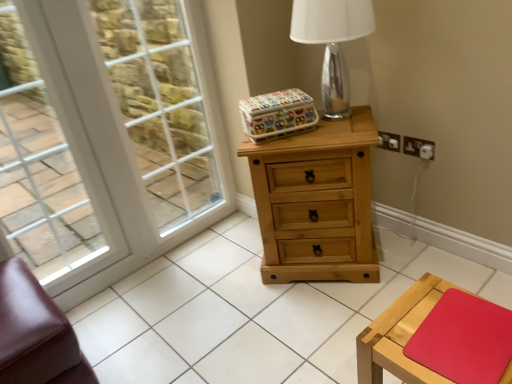
At what (x,y) coordinates should I click in order to perform the action: click on vacant area to the right of natural wood chest of drawers at center. Please return your answer as a coordinate pair (x, y). The width and height of the screenshot is (512, 384). Looking at the image, I should click on (416, 256).